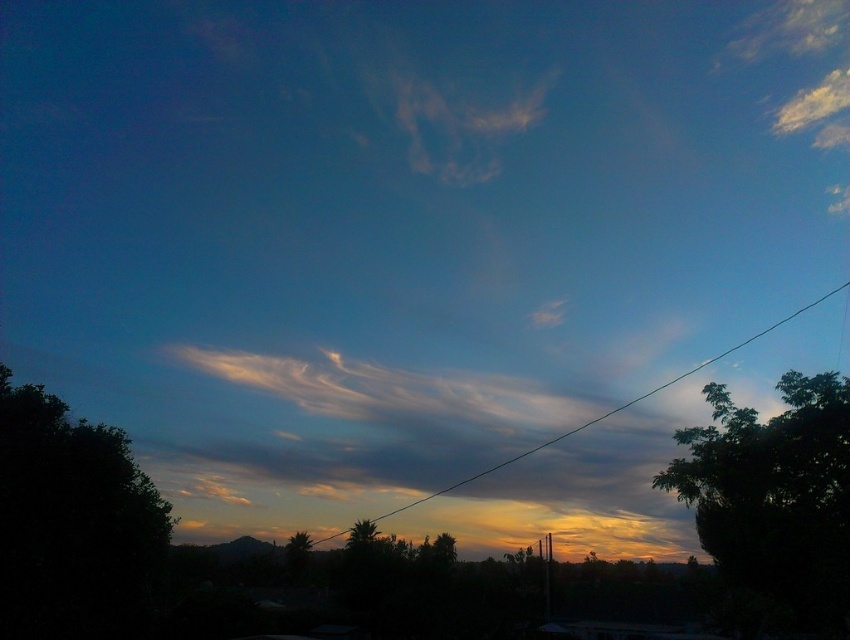
Question: Can you confirm if green leafy tree at right is bigger than green leafy tree at center?

Choices:
 (A) yes
 (B) no

Answer: (B)

Question: Is the position of green leafy tree at right more distant than that of green leafy tree at center?

Choices:
 (A) no
 (B) yes

Answer: (A)

Question: Based on their relative distances, which object is farther from the green leafy tree at center?

Choices:
 (A) green leafy tree at right
 (B) dark green leafy tree at left
 (C) green wire at center

Answer: (C)

Question: Which point appears closest to the camera in this image?

Choices:
 (A) (455, 486)
 (B) (724, 538)
 (C) (360, 547)

Answer: (B)

Question: Which point is farther to the camera?

Choices:
 (A) (425, 500)
 (B) (360, 529)
 (C) (762, 461)

Answer: (A)

Question: Is dark green leafy tree at left wider than green wire at center?

Choices:
 (A) no
 (B) yes

Answer: (A)